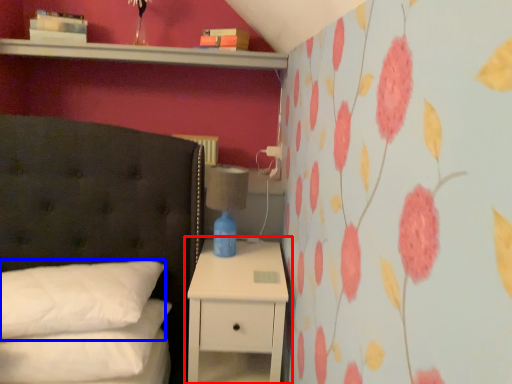
Question: Which object appears closest to the camera in this image, nightstand (highlighted by a red box) or pillow (highlighted by a blue box)?

Choices:
 (A) nightstand
 (B) pillow

Answer: (B)